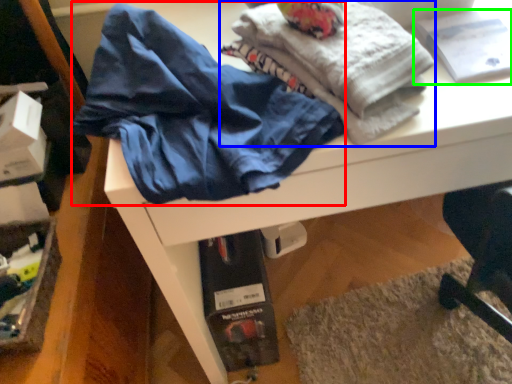
Question: Which object is positioned farthest from clothing (highlighted by a red box)? Select from fabric (highlighted by a blue box) and book (highlighted by a green box).

Choices:
 (A) fabric
 (B) book

Answer: (B)